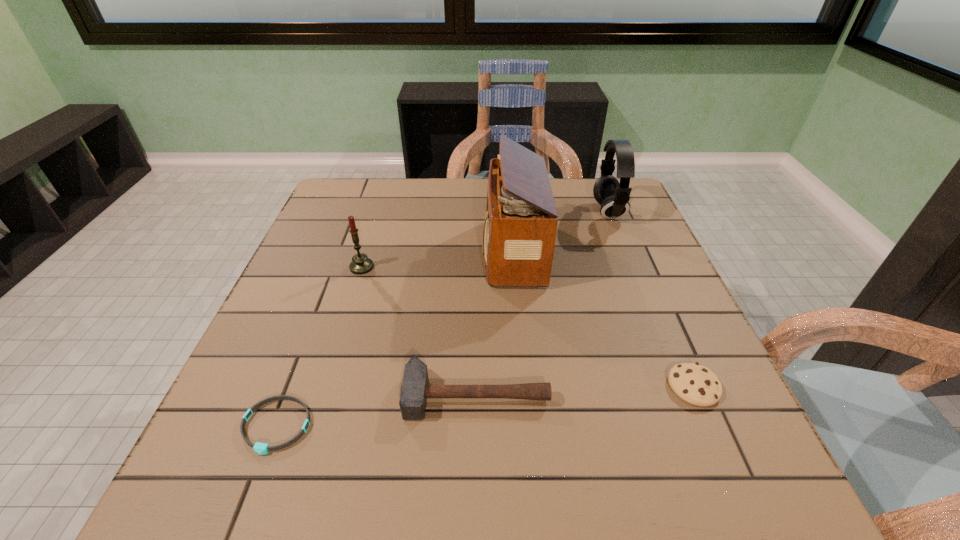
In the image, there is a desktop. What are the coordinates of `free space at the near right corner` in the screenshot? It's located at (675, 460).

This screenshot has width=960, height=540. I want to click on vacant area that lies between the radio receiver and the second shortest object, so click(x=603, y=319).

Identify the location of unoccupied position between the third tallest object and the shortest object. (319, 347).

You are a GUI agent. You are given a task and a screenshot of the screen. Output one action in this format:
    pyautogui.click(x=<x>, y=<y>)
    Task: Click on the vacant point located between the earphone and the wristband
    This screenshot has width=960, height=540.
    Given the screenshot: What is the action you would take?
    pyautogui.click(x=442, y=319)

Find the location of a particular element. vacant space that's between the fifth shortest object and the wristband is located at coordinates (442, 319).

Where is `empty space between the shortest object and the radio receiver`? empty space between the shortest object and the radio receiver is located at coordinates (395, 339).

The image size is (960, 540). I want to click on free space between the second shortest object and the third tallest object, so click(527, 327).

Find the location of a particular element. free space between the candle and the radio receiver is located at coordinates (437, 259).

Where is `vacant space that's between the fifth tallest object and the earphone`? Image resolution: width=960 pixels, height=540 pixels. vacant space that's between the fifth tallest object and the earphone is located at coordinates (651, 299).

Locate an element on the screen. free space between the fourth tallest object and the wristband is located at coordinates (376, 410).